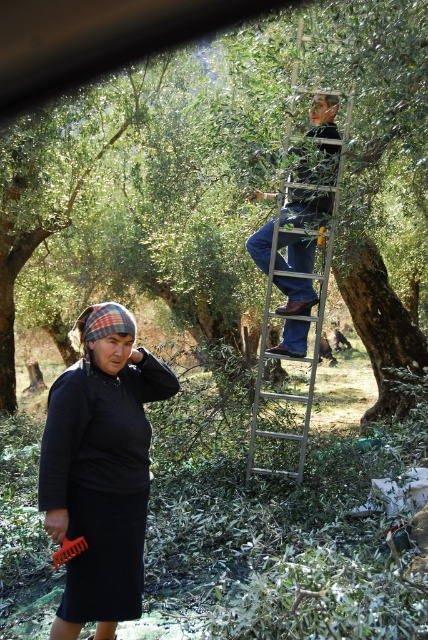
You are standing at the base of the olive tree where the silver metallic ladder at upper center is leaning. If you want to place a 3 meter long ladder there instead, would it be tall enough to reach the lowest branch of the olive tree?

The silver metallic ladder at upper center is 5.04 meters away from the viewer. Since the proposed ladder is 3 meters long, which is shorter than 5.04 meters, it would not be tall enough to reach the lowest branch of the olive tree.

You are a visitor in the olive grove and want to know which object is closer to the ground between the dark gray knit hat at lower left and the silver metallic ladder at upper center. Based on their heights, can you determine which one is closer?

The dark gray knit hat at lower left is shorter than the silver metallic ladder at upper center, so the dark gray knit hat at lower left is closer to the ground.